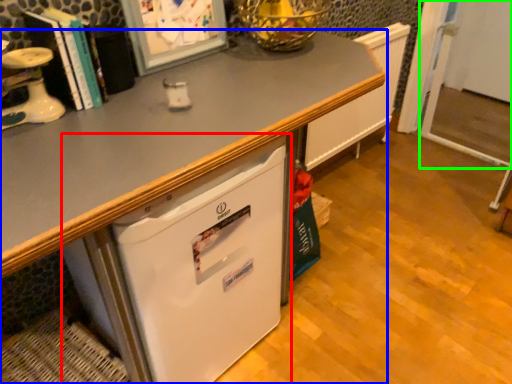
Question: Considering the real-world distances, which object is closest to refrigerator (highlighted by a red box)? desk (highlighted by a blue box) or screen door (highlighted by a green box).

Choices:
 (A) desk
 (B) screen door

Answer: (A)